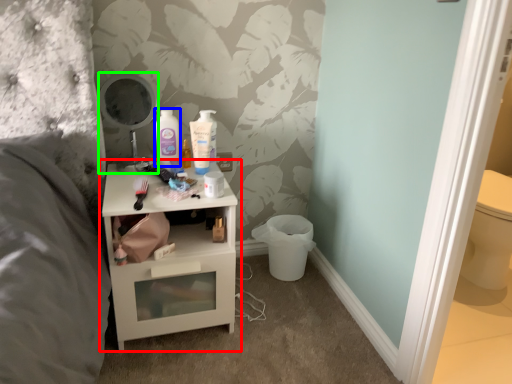
Question: Considering the real-world distances, which object is farthest from nightstand (highlighted by a red box)? mouthwash (highlighted by a blue box) or mirror (highlighted by a green box)?

Choices:
 (A) mouthwash
 (B) mirror

Answer: (A)